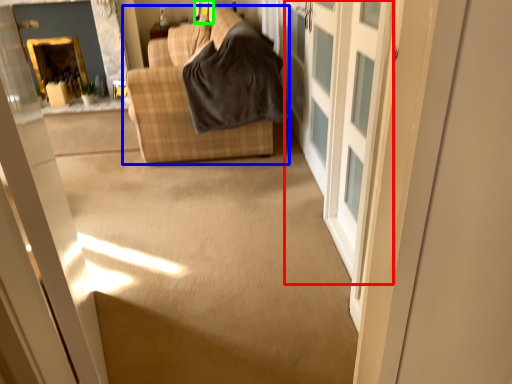
Question: Which is nearer to the barn door (highlighted by a red box)? studio couch (highlighted by a blue box) or window (highlighted by a green box).

Choices:
 (A) studio couch
 (B) window

Answer: (A)